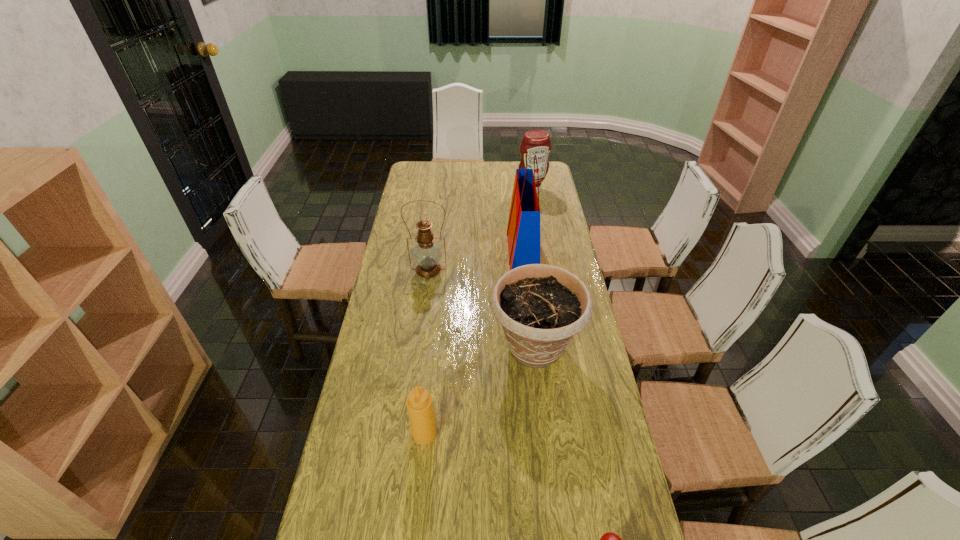
Find the location of `free region at the right edge`. free region at the right edge is located at coordinates (612, 515).

This screenshot has width=960, height=540. What are the coordinates of `vacant region at the far left corner of the desktop` in the screenshot? It's located at (434, 182).

Identify the location of vacant space that is in between the oil lamp and the leftmost condiment. (426, 352).

Image resolution: width=960 pixels, height=540 pixels. What are the coordinates of `empty space that is in between the leftmost condiment and the flowerpot` in the screenshot? It's located at (480, 390).

Locate an element on the screen. The width and height of the screenshot is (960, 540). empty space that is in between the tallest object and the oil lamp is located at coordinates (475, 261).

Image resolution: width=960 pixels, height=540 pixels. What are the coordinates of `vacant area that lies between the fourth farthest object and the oil lamp` in the screenshot? It's located at (482, 308).

Identify the location of vacant point located between the oil lamp and the fourth farthest object. (482, 308).

Locate an element on the screen. The width and height of the screenshot is (960, 540). free space between the second nearest condiment and the tallest object is located at coordinates (473, 343).

Locate an element on the screen. unoccupied position between the second nearest object and the tallest object is located at coordinates (473, 343).

The width and height of the screenshot is (960, 540). In order to click on object that is the second closest to the flowerpot in this screenshot , I will do `click(523, 231)`.